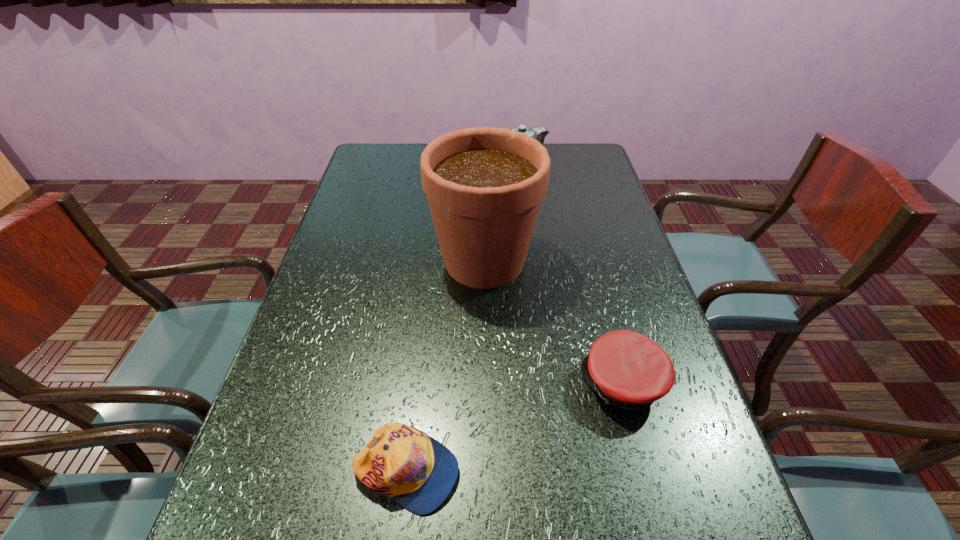
The image size is (960, 540). In order to click on the third nearest object in this screenshot , I will do `click(484, 185)`.

You are a GUI agent. You are given a task and a screenshot of the screen. Output one action in this format:
    pyautogui.click(x=<x>, y=<y>)
    Task: Click on the flowerpot
    
    Given the screenshot: What is the action you would take?
    pyautogui.click(x=484, y=185)

This screenshot has height=540, width=960. What are the coordinates of `chinaware` in the screenshot? It's located at (539, 133).

The height and width of the screenshot is (540, 960). What are the coordinates of `the third shortest object` in the screenshot? It's located at (539, 133).

In order to click on the second nearest object in this screenshot , I will do `click(628, 370)`.

The height and width of the screenshot is (540, 960). What are the coordinates of `the farther cap` in the screenshot? It's located at (628, 370).

Identify the location of the nearest object. This screenshot has width=960, height=540. (415, 470).

Find the location of a particular element. the nearer cap is located at coordinates (415, 470).

Where is `vacant space located 0.120m on the back of the third nearest object`? The image size is (960, 540). vacant space located 0.120m on the back of the third nearest object is located at coordinates (484, 204).

This screenshot has width=960, height=540. I want to click on vacant space positioned from the spout of the second tallest object, so click(x=456, y=161).